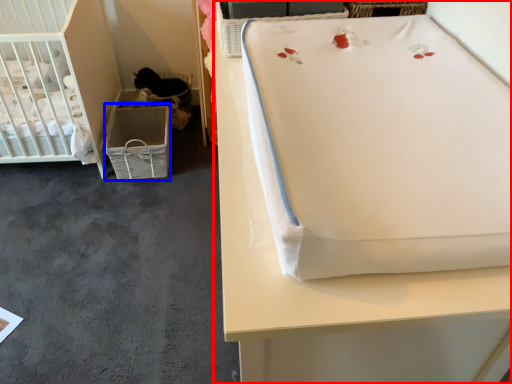
Question: Which object appears farthest to the camera in this image, furniture (highlighted by a red box) or crate (highlighted by a blue box)?

Choices:
 (A) furniture
 (B) crate

Answer: (B)